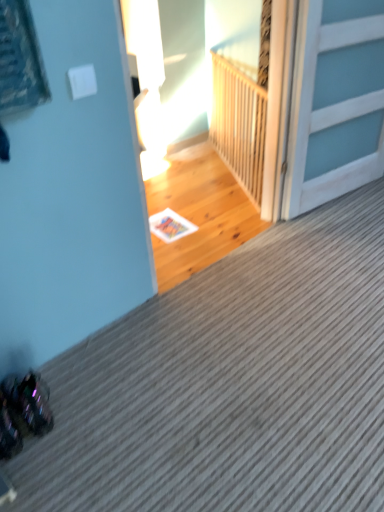
Question: Considering the positions of point (334, 42) and point (210, 138), is point (334, 42) closer or farther from the camera than point (210, 138)?

Choices:
 (A) farther
 (B) closer

Answer: (B)

Question: Is white wooden door at upper right in front of or behind wooden at upper center in the image?

Choices:
 (A) front
 (B) behind

Answer: (A)

Question: Considering the positions of white wooden door at upper right and wooden at upper center in the image, is white wooden door at upper right taller or shorter than wooden at upper center?

Choices:
 (A) short
 (B) tall

Answer: (B)

Question: In terms of height, does wooden at upper center look taller or shorter compared to white wooden door at upper right?

Choices:
 (A) short
 (B) tall

Answer: (A)

Question: Visually, is wooden at upper center positioned to the left or to the right of white wooden door at upper right?

Choices:
 (A) right
 (B) left

Answer: (B)

Question: Is wooden at upper center inside or outside of white wooden door at upper right?

Choices:
 (A) inside
 (B) outside

Answer: (B)

Question: From a real-world perspective, is wooden at upper center physically located above or below white wooden door at upper right?

Choices:
 (A) above
 (B) below

Answer: (B)